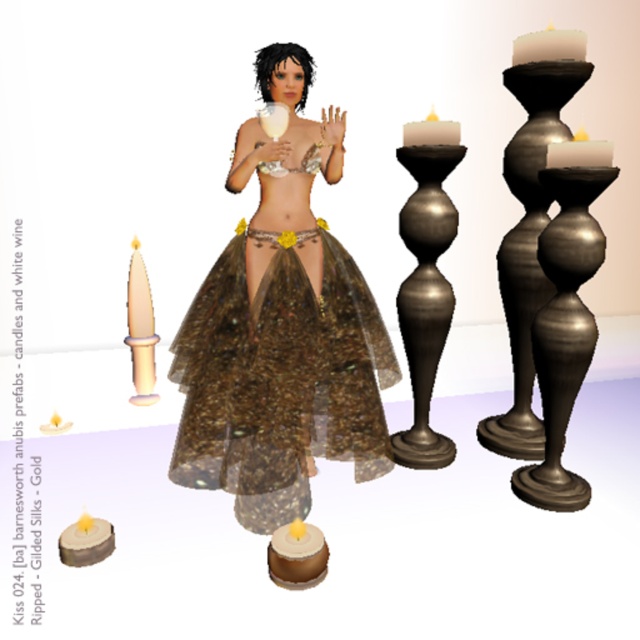
Question: Is ripped gilded silks at center thinner than polished bronze candlestick at right?

Choices:
 (A) yes
 (B) no

Answer: (B)

Question: Which point is farther to the camera?

Choices:
 (A) (308, 157)
 (B) (438, 321)

Answer: (B)

Question: Based on their relative distances, which object is farther from the matte gold candlestick at lower left?

Choices:
 (A) ripped gilded silks at center
 (B) white matte candle at upper right
 (C) gold shimmering bikini top at center
 (D) gold sequined bikini top at center

Answer: (B)

Question: Considering the real-world distances, which object is closest to the matte black candle at upper right?

Choices:
 (A) brown matte cake at lower center
 (B) gold sequined bikini top at center
 (C) ripped gilded silks at center
 (D) matte gold candlestick at lower left

Answer: (B)

Question: Can you confirm if white matte candle at upper right is positioned above white matte candle at upper center?

Choices:
 (A) no
 (B) yes

Answer: (B)

Question: Does polished bronze candlestick at right lie in front of matte gold candlestick at lower left?

Choices:
 (A) yes
 (B) no

Answer: (A)